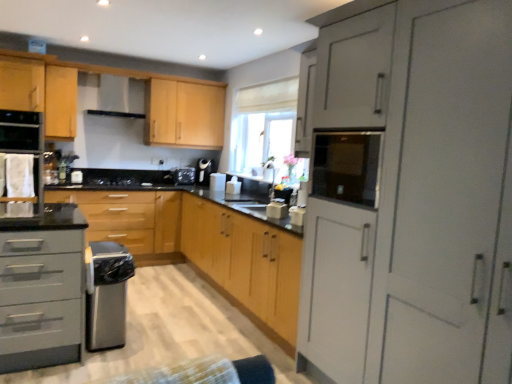
Question: Is black matte gas stove at center wider or thinner than white glossy toaster at center, which ranks as the second appliance in right-to-left order?

Choices:
 (A) wide
 (B) thin

Answer: (A)

Question: In the image, is black matte gas stove at center positioned in front of or behind white glossy toaster at center, which is counted as the 4th appliance, starting from the back?

Choices:
 (A) front
 (B) behind

Answer: (A)

Question: Which object is the farthest from the satin silver dishwasher at lower left?

Choices:
 (A) white fabric oven at left
 (B) black glass microwave at upper right
 (C) matte black toaster at center, placed as the 1th appliance when sorted from right to left
 (D) white glossy paper towel dispenser at center, the fourth appliance viewed from the front
 (E) black glass oven at left, marked as the 2th appliance in a front-to-back arrangement

Answer: (D)

Question: Which object is positioned farthest from the light wood cabinet at upper left, the 1th cabinetry when ordered from back to front?

Choices:
 (A) matte black toaster at center, arranged as the sixth appliance when viewed from the left
 (B) white fabric oven at left
 (C) matte gray cabinet at left, the 4th cabinetry positioned from the back
 (D) black matte exhaust hood at upper center
 (E) wooden cabinet at center, the 2th cabinetry from the back

Answer: (A)